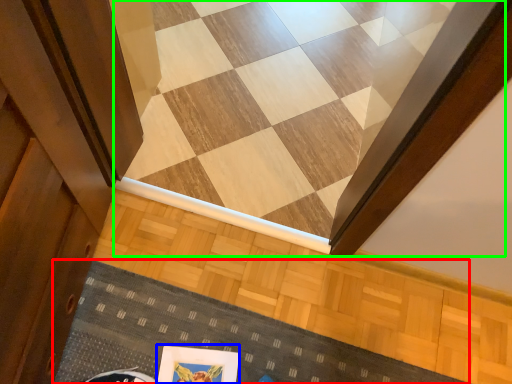
Question: Which object is the closest to the doormat (highlighted by a red box)? Choose among these: picture frame (highlighted by a blue box) or stairwell (highlighted by a green box).

Choices:
 (A) picture frame
 (B) stairwell

Answer: (A)